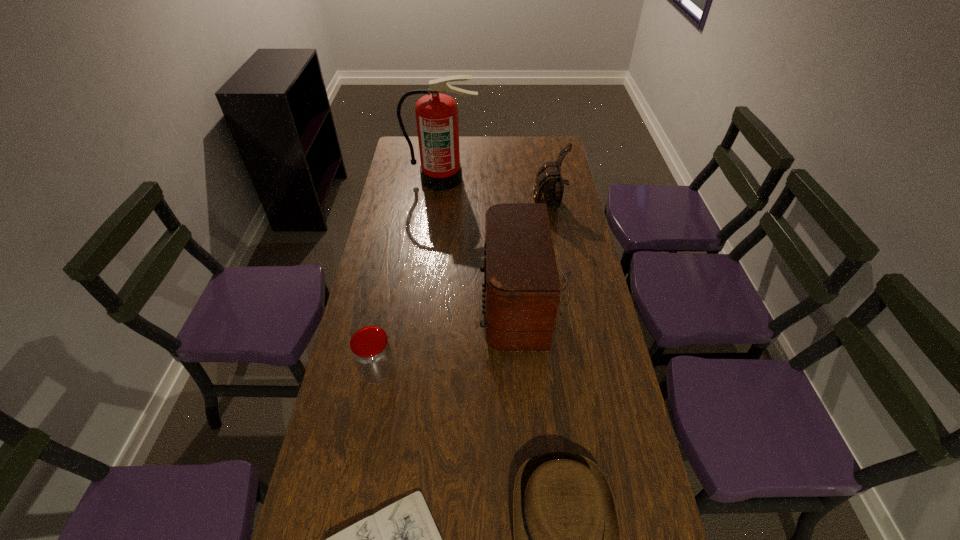
You are a GUI agent. You are given a task and a screenshot of the screen. Output one action in this format:
    pyautogui.click(x=<x>, y=<y>)
    Task: Click on the free spot located 0.310m on the front-facing side of the fifth nearest object
    
    Given the screenshot: What is the action you would take?
    pyautogui.click(x=458, y=208)

At what (x,y) coordinates should I click in order to perform the action: click on vacant space located on the front-facing side of the fifth nearest object. Please return your answer as a coordinate pair (x, y). The image size is (960, 540). Looking at the image, I should click on (435, 208).

At what (x,y) coordinates should I click in order to perform the action: click on free space located 0.080m on the front-facing side of the fifth nearest object. Please return your answer as a coordinate pair (x, y). The height and width of the screenshot is (540, 960). Looking at the image, I should click on (514, 208).

The image size is (960, 540). I want to click on blank space located on the front of the jar, so click(x=360, y=469).

Where is `fire extinguisher present at the left edge`? fire extinguisher present at the left edge is located at coordinates (436, 114).

Where is `jar that is at the left edge`? This screenshot has height=540, width=960. jar that is at the left edge is located at coordinates (371, 351).

Locate an element on the screen. Image resolution: width=960 pixels, height=540 pixels. radio receiver that is at the right edge is located at coordinates (521, 293).

Where is `shoulder bag present at the right edge`? shoulder bag present at the right edge is located at coordinates (549, 185).

Locate an element on the screen. This screenshot has height=540, width=960. free space at the left edge of the desktop is located at coordinates (415, 173).

Identify the location of vacant space at the right edge. (614, 404).